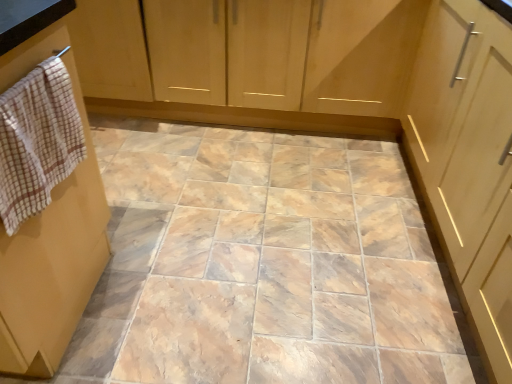
Question: Is white checkered hand towel at left inside the boundaries of wooden cabinet at upper left, or outside?

Choices:
 (A) inside
 (B) outside

Answer: (B)

Question: From the image's perspective, is white checkered hand towel at left above or below wooden cabinet at upper left?

Choices:
 (A) below
 (B) above

Answer: (A)

Question: In the image, is white checkered hand towel at left positioned in front of or behind wooden cabinet at upper left?

Choices:
 (A) front
 (B) behind

Answer: (A)

Question: Would you say wooden cabinet at upper left is inside or outside white checkered hand towel at left?

Choices:
 (A) outside
 (B) inside

Answer: (A)

Question: Would you say wooden cabinet at upper left is to the left or to the right of white checkered hand towel at left in the picture?

Choices:
 (A) left
 (B) right

Answer: (B)

Question: Is wooden cabinet at upper left in front of or behind white checkered hand towel at left in the image?

Choices:
 (A) behind
 (B) front

Answer: (A)

Question: In terms of width, does wooden cabinet at upper left look wider or thinner when compared to white checkered hand towel at left?

Choices:
 (A) thin
 (B) wide

Answer: (B)